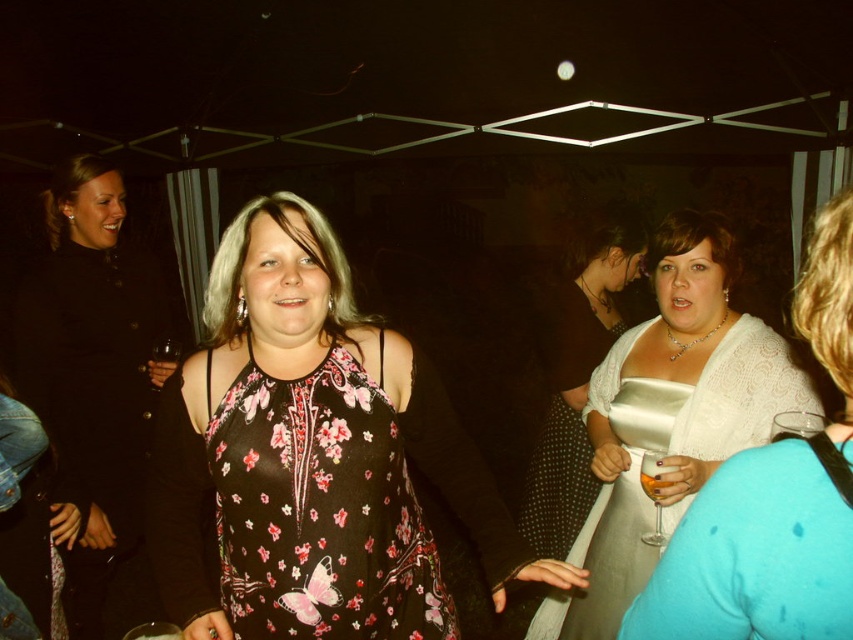
Measure the distance between point (317, 602) and camera.

1.28 meters

Can you confirm if floral-patterned fabric dress at center is bigger than white satin dress at center?

Actually, floral-patterned fabric dress at center might be smaller than white satin dress at center.

Between point (364, 536) and point (544, 458), which one is positioned in front?

Point (364, 536)

Locate an element on the screen. Image resolution: width=853 pixels, height=640 pixels. floral-patterned fabric dress at center is located at coordinates point(318,509).

What do you see at coordinates (670, 416) in the screenshot? This screenshot has height=640, width=853. I see `satin white dress at center` at bounding box center [670, 416].

Can you confirm if satin white dress at center is bigger than translucent glass wine at center?

Yes, satin white dress at center is bigger than translucent glass wine at center.

The width and height of the screenshot is (853, 640). In order to click on satin white dress at center in this screenshot , I will do `click(670, 416)`.

Does floral-patterned fabric dress at center have a lesser width compared to matte black dress at left?

Yes, floral-patterned fabric dress at center is thinner than matte black dress at left.

Is floral-patterned fabric dress at center to the right of matte black dress at left from the viewer's perspective?

Correct, you'll find floral-patterned fabric dress at center to the right of matte black dress at left.

Is point (227, 464) positioned after point (56, 406)?

No, (227, 464) is closer to viewer.

At what (x,y) coordinates should I click in order to perform the action: click on floral-patterned fabric dress at center. Please return your answer as a coordinate pair (x, y). The width and height of the screenshot is (853, 640). Looking at the image, I should click on click(318, 509).